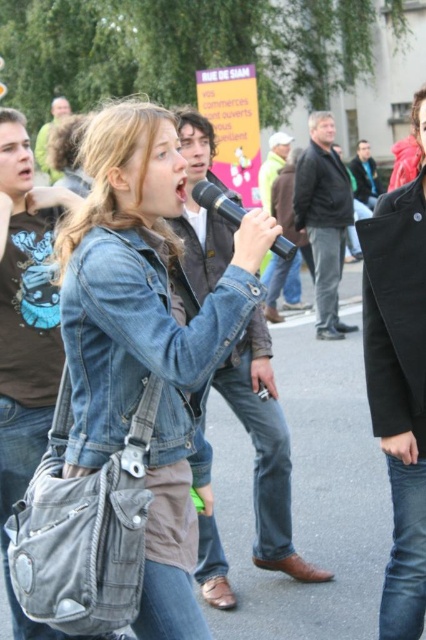
You are a photographer at the event and want to capture a photo that includes both the black matte jacket at upper right and the black matte microphone at center. Which object should you position closer to the right edge of your camera frame?

The black matte jacket at upper right is positioned on the right side of black matte microphone at center, so to include both in the photo, position the black matte jacket at upper right closer to the right edge of your camera frame.